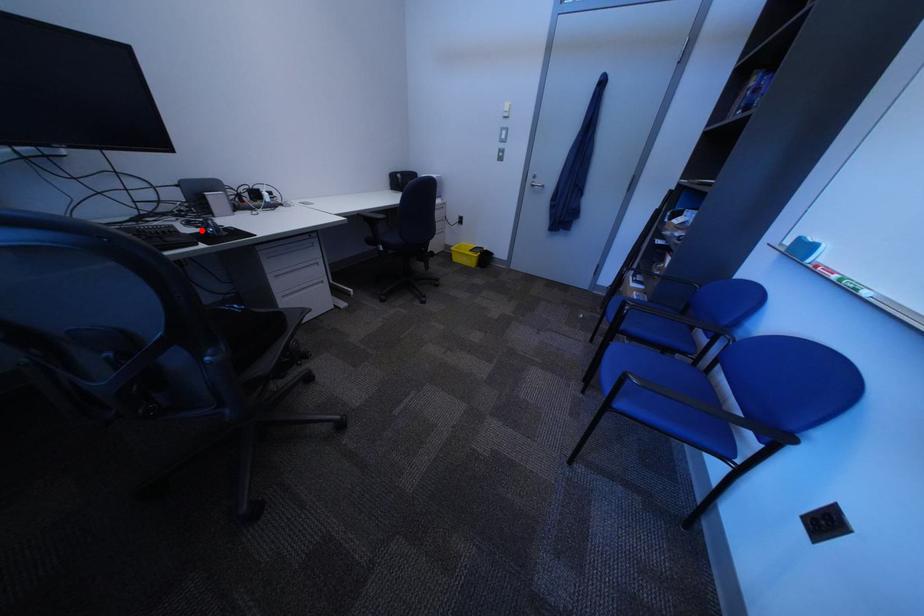
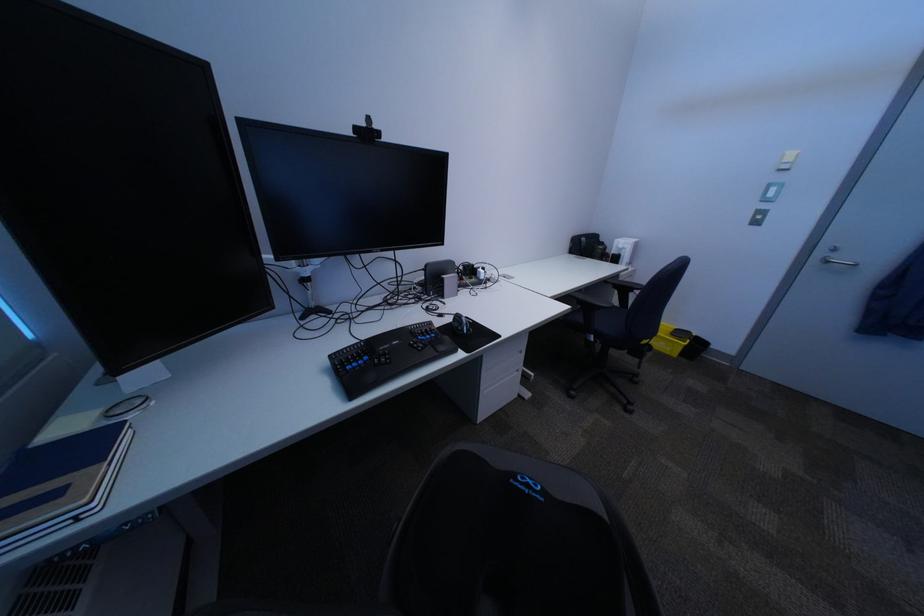
Find the pixel in the second image that matches the highlighted location in the first image.

(454, 325)